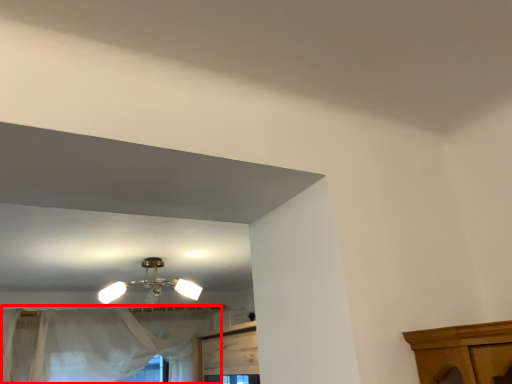
Question: From the image's perspective, where is curtain (annotated by the red box) located in relation to lamp in the image?

Choices:
 (A) below
 (B) above

Answer: (A)